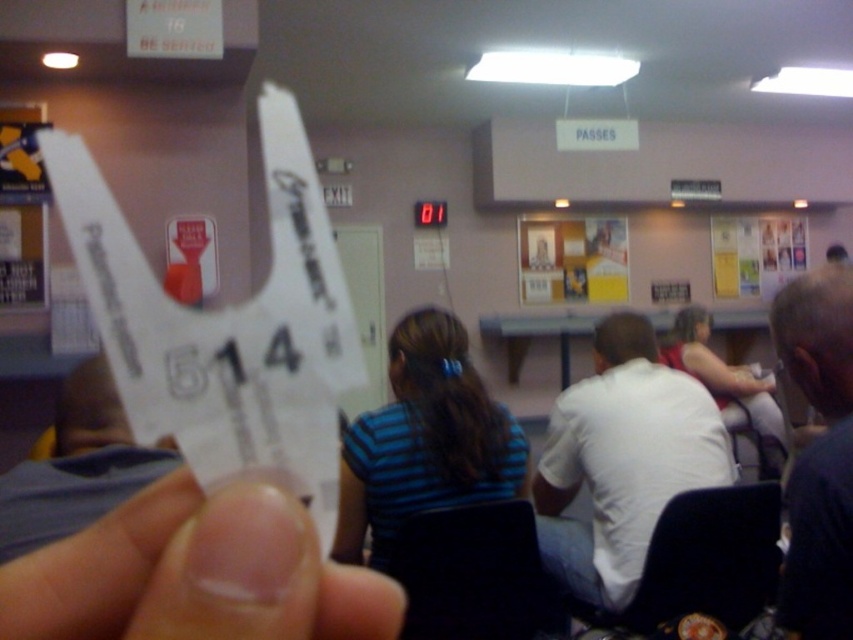
Question: Is white paper at center further to camera compared to white paper clip at center?

Choices:
 (A) no
 (B) yes

Answer: (A)

Question: Can you confirm if white paper at center is smaller than wooden bulletin board at upper center?

Choices:
 (A) yes
 (B) no

Answer: (A)

Question: Among these points, which one is nearest to the camera?

Choices:
 (A) (349, 492)
 (B) (833, 275)

Answer: (B)

Question: Which of the following is the farthest from the observer?

Choices:
 (A) white paper at center
 (B) white paper clip at center

Answer: (B)

Question: Which point appears farthest from the camera in this image?

Choices:
 (A) (366, 465)
 (B) (729, 419)
 (C) (1, 490)
 (D) (840, 275)

Answer: (B)

Question: Is wooden bulletin board at upper center positioned in front of matte white shirt at center?

Choices:
 (A) yes
 (B) no

Answer: (B)